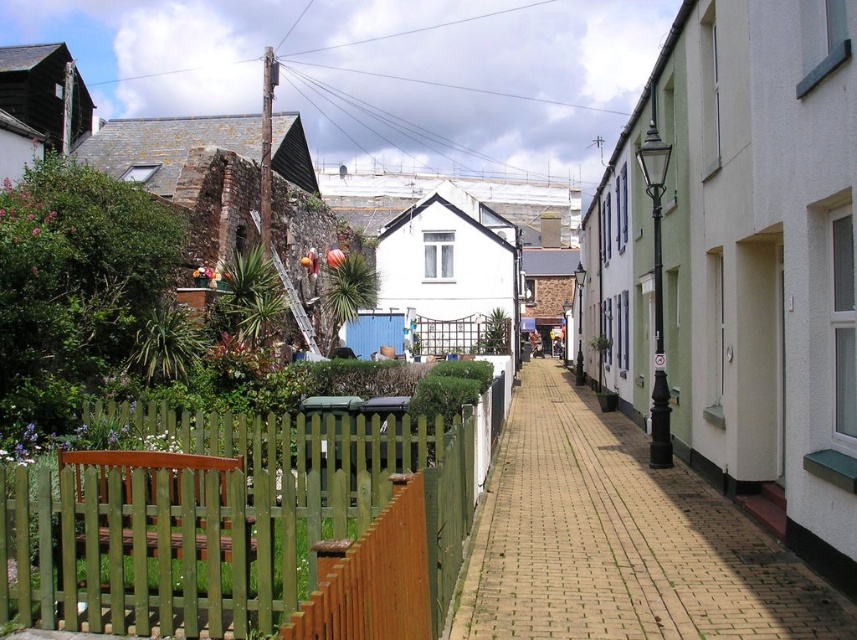
From the picture: You are a delivery person trying to navigate through the narrow street. You need to deliver a package to the address located behind the green wooden fence at lower left. To reach it, you must go around the brick paved walkway at center. Which direction should you take first?

The green wooden fence at lower left is located above the brick paved walkway at center, so you should go upwards towards the green wooden fence at lower left to reach it first.